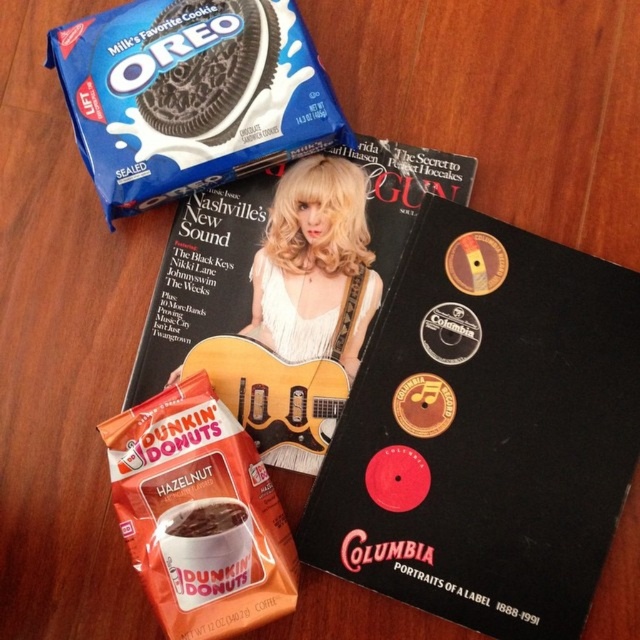
Based on the provided scene description, where is the matte black magazine at upper center located?

The matte black magazine at upper center is located at point coordinates of (202, 276).

You are organizing items on a desk and need to place a new item between the matte black magazine at upper center and the white matte dunkin donuts coffee at lower left. Based on their positions, where should you place the new item?

The new item should be placed between the matte black magazine at upper center and the white matte dunkin donuts coffee at lower left, positioned below the magazine and above the coffee packets since the magazine is above the coffee.